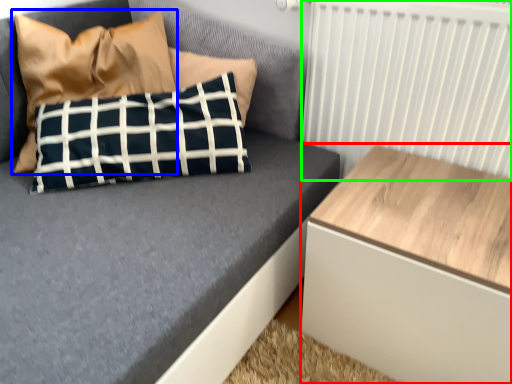
Question: Which is farther away from table (highlighted by a red box)? pillow (highlighted by a blue box) or radiator (highlighted by a green box)?

Choices:
 (A) pillow
 (B) radiator

Answer: (A)